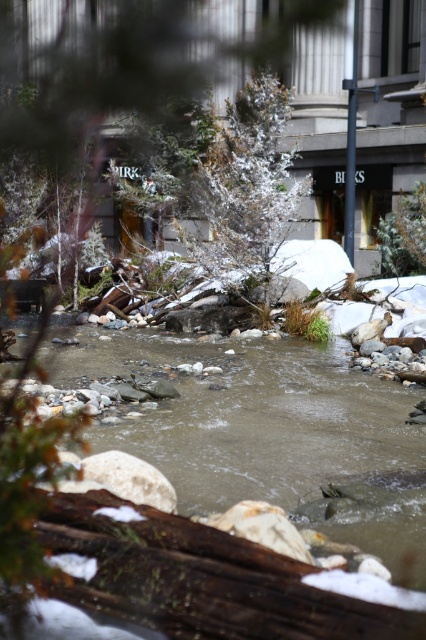
You are standing at the origin point in the image. Which direction should you move to reach the smooth rock stream at center?

The smooth rock stream at center is located at coordinates approximately 0.669 on the x axis and 0.610 on the y axis, so you should move northeast to reach it.

You are standing at the edge of the snowy landscape and want to cross the stream. You see the smooth rock stream at center and the brown rough log at lower center. Which object is higher in elevation, and would stepping onto it first help you cross the stream safely?

The smooth rock stream at center is taller than the brown rough log at lower center. Stepping onto the smooth rock stream at center first would help you cross the stream safely as it is higher in elevation.